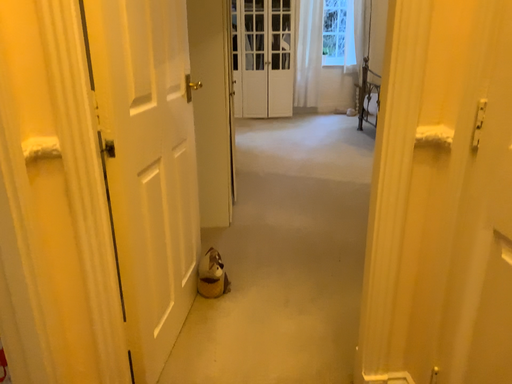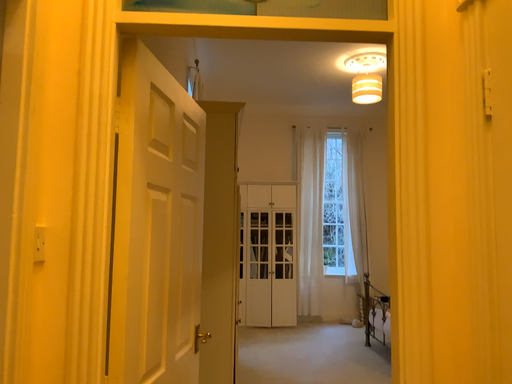
Question: Which way did the camera rotate in the video?

Choices:
 (A) rotated upward
 (B) rotated downward

Answer: (A)